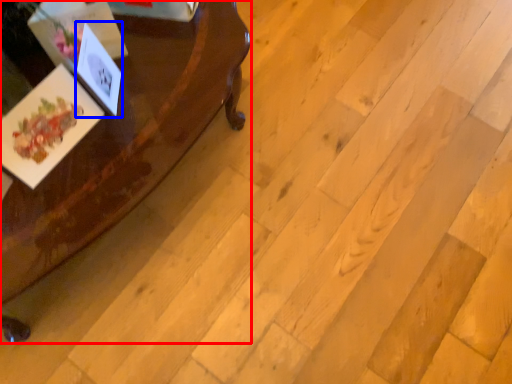
Question: Which object appears farthest to the camera in this image, table (highlighted by a red box) or postcard (highlighted by a blue box)?

Choices:
 (A) table
 (B) postcard

Answer: (B)